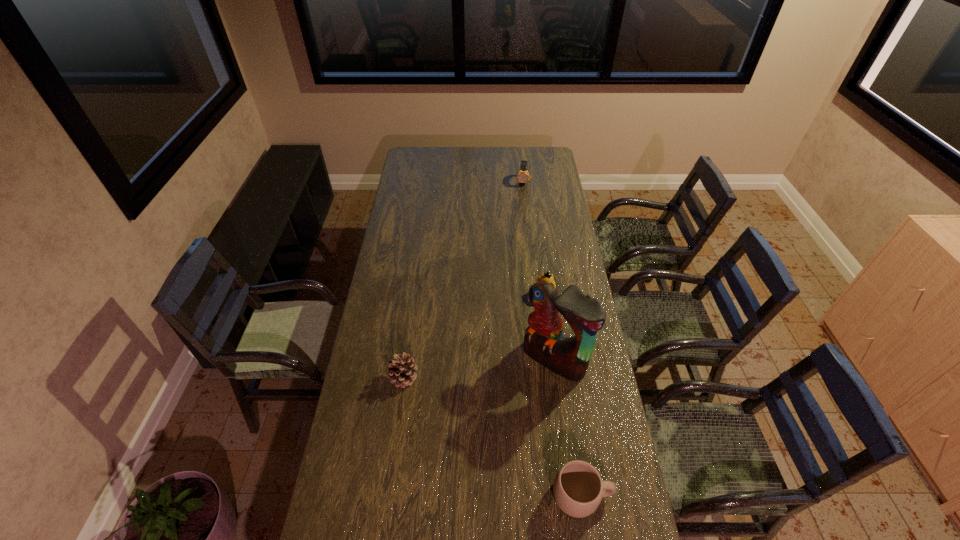
Find the location of a particular element. vacant space on the desktop that is between the pinecone and the nearest object and is positioned at the face of the parrot is located at coordinates (489, 434).

Where is `vacant spot on the desktop that is between the leftmost object and the nearest object and is positioned on the face of the second farthest object`? vacant spot on the desktop that is between the leftmost object and the nearest object and is positioned on the face of the second farthest object is located at coordinates (462, 415).

Image resolution: width=960 pixels, height=540 pixels. Identify the location of free space on the desktop that is between the pinecone and the nearest object and is positioned on the face of the watch. (509, 447).